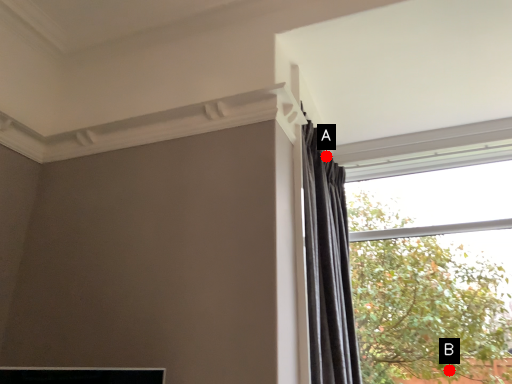
Question: Two points are circled on the image, labeled by A and B beside each circle. Which point appears closest to the camera in this image?

Choices:
 (A) A is closer
 (B) B is closer

Answer: (A)